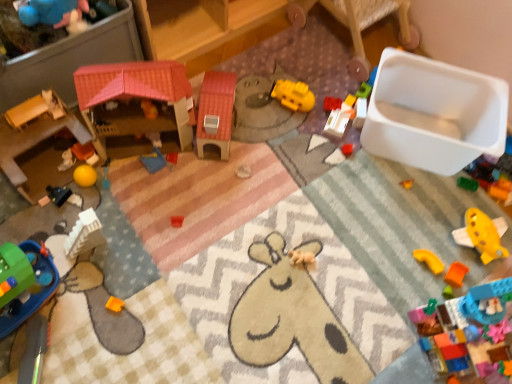
At what (x,y) coordinates should I click in order to perform the action: click on empty space that is in between yellow plastic airplane at lower right, arranged as the 15th toy when viewed from the left, and matte orange blocks at left, positioned as the fifth toy in left-to-right order. Please return your answer as a coordinate pair (x, y). Looking at the image, I should click on (303, 209).